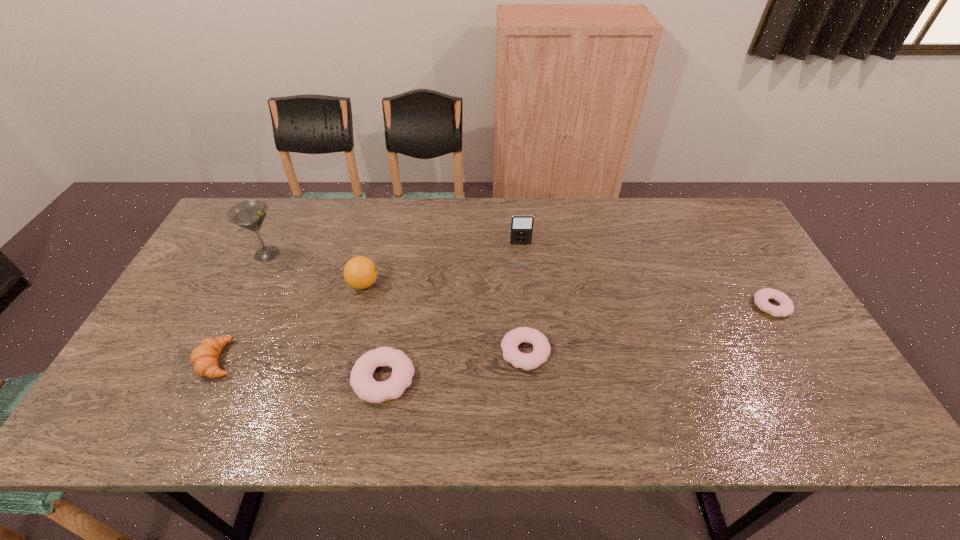
Where is `the third shortest object`? This screenshot has width=960, height=540. the third shortest object is located at coordinates (361, 378).

You are a GUI agent. You are given a task and a screenshot of the screen. Output one action in this format:
    pyautogui.click(x=<x>, y=<y>)
    Task: Click on the tallest doughnut
    The image size is (960, 540).
    Given the screenshot: What is the action you would take?
    pyautogui.click(x=361, y=378)

Where is `the second tallest doughnut`? Image resolution: width=960 pixels, height=540 pixels. the second tallest doughnut is located at coordinates (541, 348).

Where is `the second doughnut from right to left`? Image resolution: width=960 pixels, height=540 pixels. the second doughnut from right to left is located at coordinates (541, 348).

The image size is (960, 540). Identify the location of the shortest doughnut. (786, 307).

This screenshot has width=960, height=540. In order to click on the rightmost doughnut in this screenshot , I will do `click(786, 307)`.

You are a GUI agent. You are given a task and a screenshot of the screen. Output one action in this format:
    pyautogui.click(x=<x>, y=<y>)
    Task: Click on the tallest object
    This screenshot has height=540, width=960.
    Given the screenshot: What is the action you would take?
    pyautogui.click(x=250, y=214)

This screenshot has width=960, height=540. What are the coordinates of `iPod` in the screenshot? It's located at (521, 225).

You are a GUI agent. You are given a task and a screenshot of the screen. Output one action in this format:
    pyautogui.click(x=<x>, y=<y>)
    Task: Click on the third tallest object
    The width and height of the screenshot is (960, 540).
    Given the screenshot: What is the action you would take?
    pyautogui.click(x=360, y=272)

Where is `the fourth shortest object`? the fourth shortest object is located at coordinates (204, 358).